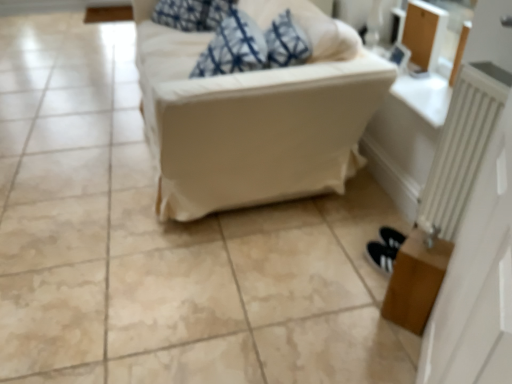
Question: Does brown wooden table at lower right have a greater height compared to white fabric couch at center?

Choices:
 (A) yes
 (B) no

Answer: (B)

Question: From the image's perspective, is brown wooden table at lower right above white fabric couch at center?

Choices:
 (A) yes
 (B) no

Answer: (B)

Question: Considering the relative positions of brown wooden table at lower right and white fabric couch at center in the image provided, is brown wooden table at lower right behind white fabric couch at center?

Choices:
 (A) no
 (B) yes

Answer: (A)

Question: Could you tell me if brown wooden table at lower right is facing white fabric couch at center?

Choices:
 (A) yes
 (B) no

Answer: (A)

Question: Does brown wooden table at lower right have a greater width compared to white fabric couch at center?

Choices:
 (A) yes
 (B) no

Answer: (B)

Question: Looking at the image, does white metallic radiator at right seem bigger or smaller compared to white fabric couch at center?

Choices:
 (A) small
 (B) big

Answer: (A)

Question: Relative to white fabric couch at center, is white metallic radiator at right in front or behind?

Choices:
 (A) front
 (B) behind

Answer: (A)

Question: Is white metallic radiator at right spatially inside white fabric couch at center, or outside of it?

Choices:
 (A) inside
 (B) outside

Answer: (B)

Question: From the image's perspective, is white metallic radiator at right located above or below white fabric couch at center?

Choices:
 (A) above
 (B) below

Answer: (B)

Question: Relative to brown wooden table at lower right, is white metallic radiator at right in front or behind?

Choices:
 (A) behind
 (B) front

Answer: (B)

Question: From the image's perspective, relative to brown wooden table at lower right, is white metallic radiator at right above or below?

Choices:
 (A) below
 (B) above

Answer: (B)

Question: Is white metallic radiator at right inside the boundaries of brown wooden table at lower right, or outside?

Choices:
 (A) inside
 (B) outside

Answer: (B)

Question: From a real-world perspective, is white metallic radiator at right above or below brown wooden table at lower right?

Choices:
 (A) below
 (B) above

Answer: (B)

Question: From the image's perspective, is white fabric couch at center above or below white metallic radiator at right?

Choices:
 (A) above
 (B) below

Answer: (A)

Question: From a real-world perspective, is white fabric couch at center physically located above or below white metallic radiator at right?

Choices:
 (A) above
 (B) below

Answer: (A)